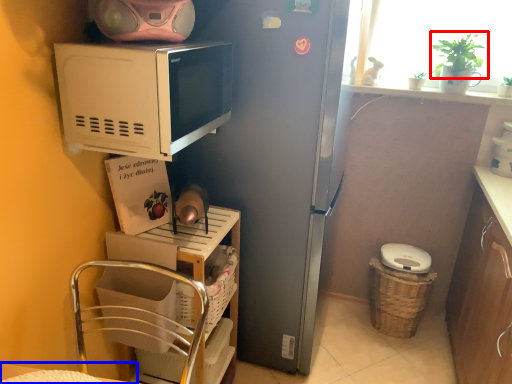
Question: Among these objects, which one is nearest to the camera, plant (highlighted by a red box) or table (highlighted by a blue box)?

Choices:
 (A) plant
 (B) table

Answer: (B)